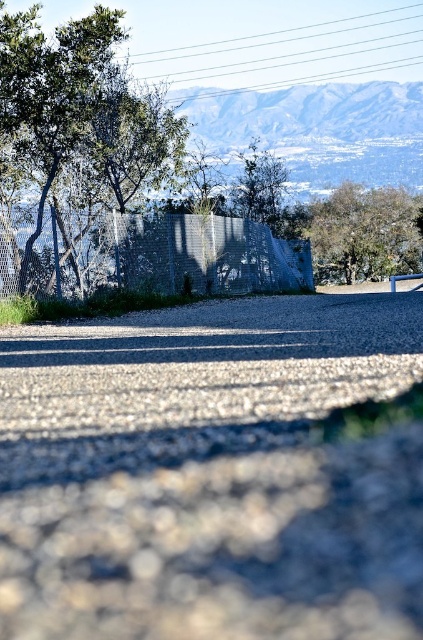
You are a landscape architect designing a garden. You need to place a tall sculpture between the green leafy tree at left and the green leafy tree at upper right. Which tree should the sculpture be placed closer to so it doesn

The sculpture should be placed closer to the green leafy tree at left because it is taller than the green leafy tree at upper right, providing better visual balance.

You are a gardener planning to plant a new flower bed. You see the gray gravel at center and the green leafy tree at left. Which object is located below the other?

The gray gravel at center is positioned under the green leafy tree at left.

You are a drone operator planning a flight path over this outdoor scene. Your drone must fly from the starting point at point (200, 448) to the endpoint at point (398, 257). According to the scene description, which point is closer to the observer, the starting point or the endpoint?

The starting point at point (200, 448) is closer to the observer because it is in front of the endpoint at point (398, 257) as per the spatial relationship described.